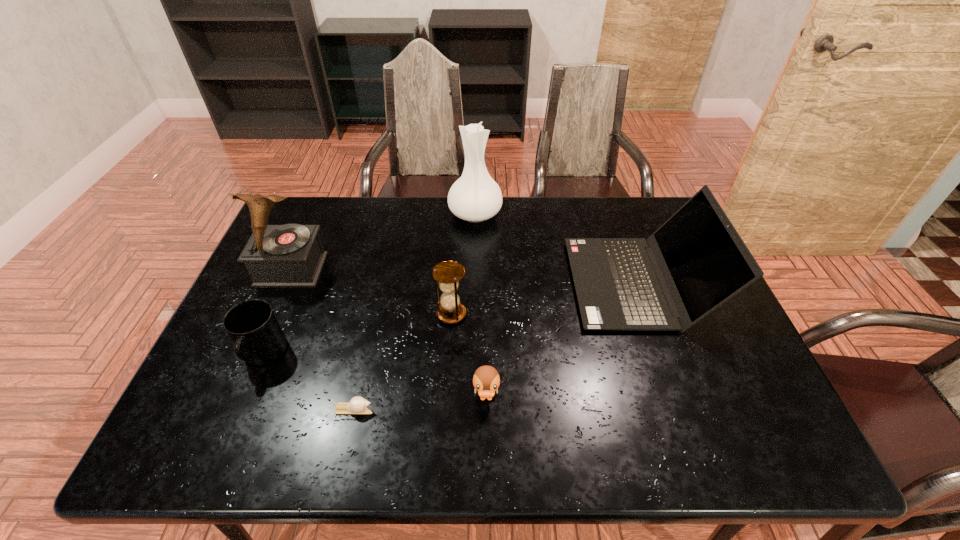
Where is `the farthest object`? the farthest object is located at coordinates (475, 196).

This screenshot has height=540, width=960. What are the coordinates of `phonograph_record` in the screenshot? It's located at (291, 255).

This screenshot has height=540, width=960. I want to click on laptop computer, so click(x=696, y=261).

The height and width of the screenshot is (540, 960). I want to click on the fifth shortest object, so click(x=696, y=261).

Where is `the fourth tallest object`? This screenshot has width=960, height=540. the fourth tallest object is located at coordinates (448, 273).

Locate an element on the screen. Image resolution: width=960 pixels, height=540 pixels. mug is located at coordinates (259, 339).

Identify the location of the second shortest object. (486, 380).

The width and height of the screenshot is (960, 540). I want to click on escargot, so click(358, 405).

Where is `the fifth object from right to left`? The image size is (960, 540). the fifth object from right to left is located at coordinates [x=358, y=405].

At what (x,y) coordinates should I click in order to perform the action: click on free location located on the left of the vase. Please return your answer as a coordinate pair (x, y). This screenshot has width=960, height=540. Looking at the image, I should click on (410, 214).